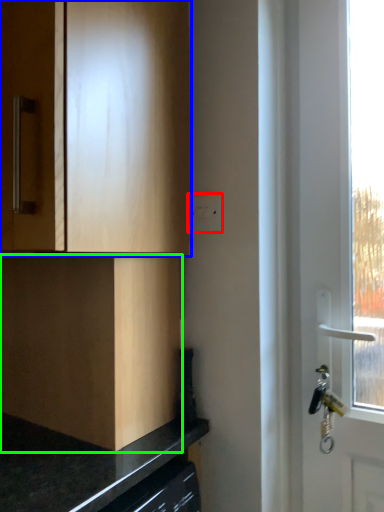
Question: Which is nearer to the electric outlet (highlighted by a red box)? cabinetry (highlighted by a blue box) or cabinetry (highlighted by a green box).

Choices:
 (A) cabinetry
 (B) cabinetry

Answer: (A)